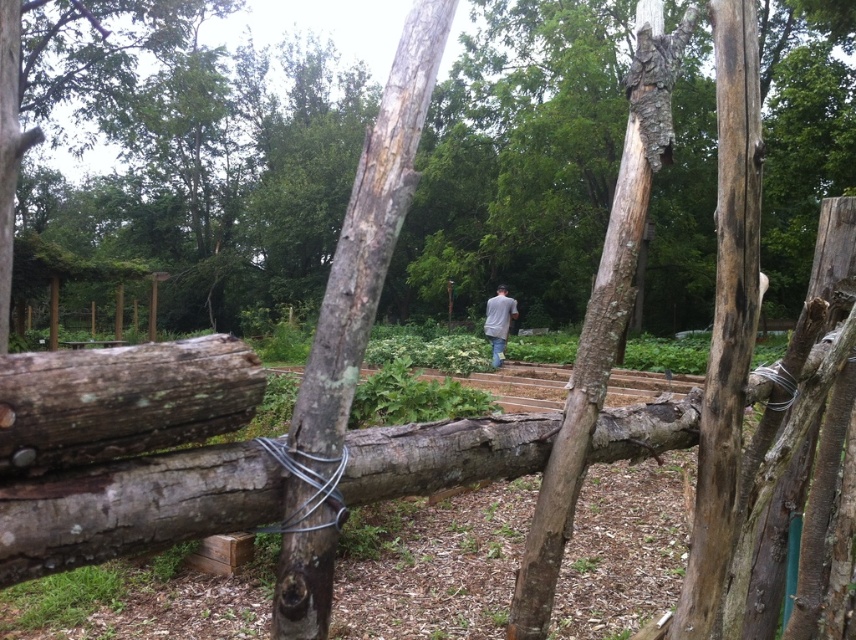
Is grayish-brown bark at center taller than gray matte shirt at center?

No, grayish-brown bark at center is not taller than gray matte shirt at center.

Who is shorter, grayish-brown bark at center or gray matte shirt at center?

grayish-brown bark at center is shorter.

Between point (292, 520) and point (496, 321), which one is positioned in front?

Point (292, 520) is more forward.

Locate an element on the screen. The image size is (856, 640). grayish-brown bark at center is located at coordinates (349, 330).

Is point (715, 532) less distant than point (617, 182)?

No, it is not.

Can you confirm if dark brown wood pole at center is wider than smooth brown tree trunk at center?

Yes, dark brown wood pole at center is wider than smooth brown tree trunk at center.

Between point (736, 244) and point (581, 353), which one is positioned behind?

Point (736, 244)

At what (x,y) coordinates should I click in order to perform the action: click on dark brown wood pole at center. Please return your answer as a coordinate pair (x, y). Looking at the image, I should click on (726, 320).

Is rough bark tree at center closer to the viewer compared to dark brown wood pole at center?

Yes.

Between point (712, 99) and point (721, 19), which one is positioned behind?

Positioned behind is point (712, 99).

Who is more distant from viewer, (265, 196) or (697, 544)?

The point (265, 196) is behind.

Locate an element on the screen. rough bark tree at center is located at coordinates (199, 160).